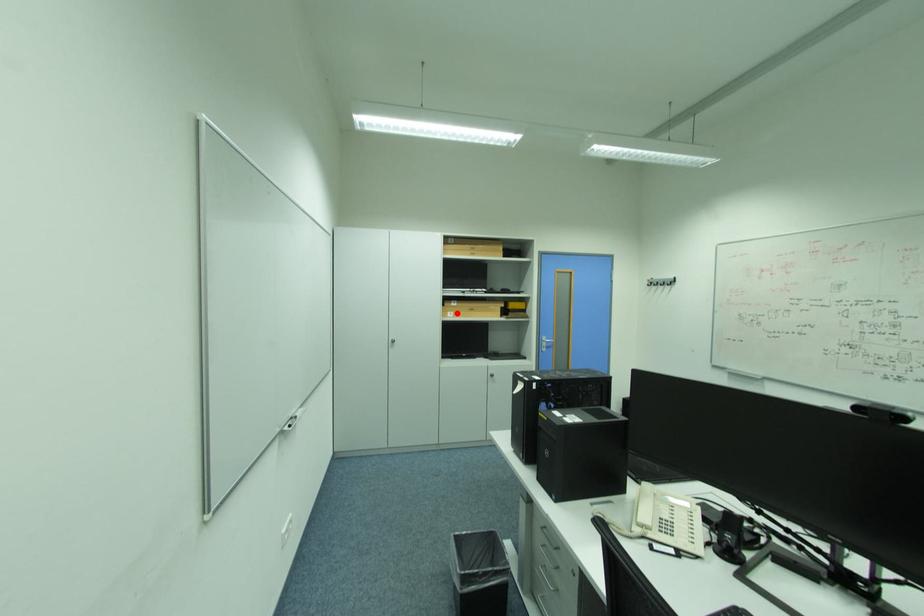
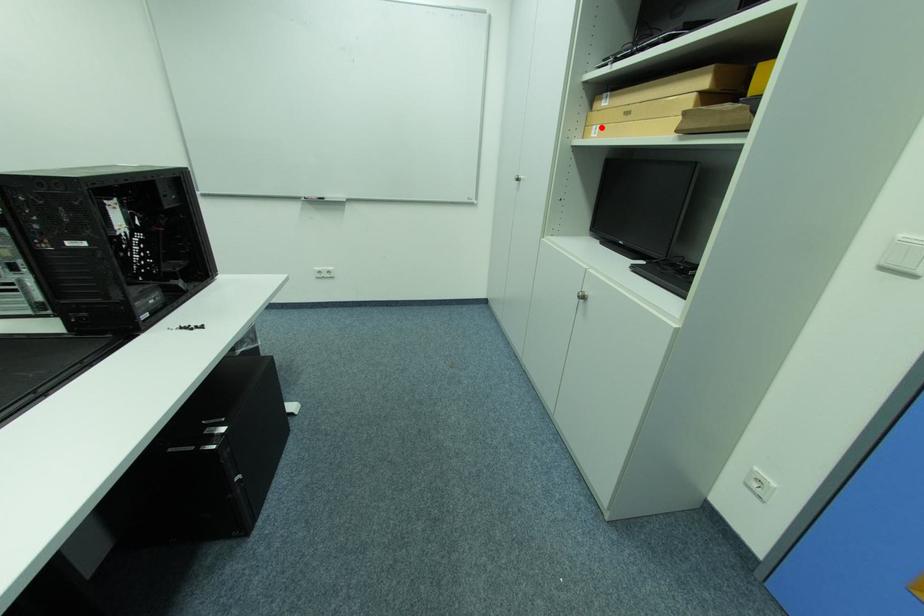
I am providing you with two images of the same scene from different viewpoints. A red point is marked on the first image and another point is marked on the second image. Does the point marked in image1 correspond to the same location as the one in image2?

Yes